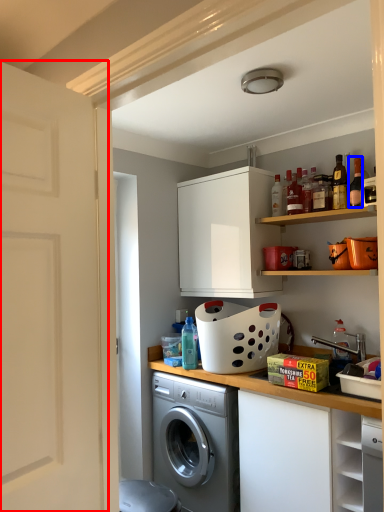
Question: Which object is closer to the camera taking this photo, door (highlighted by a red box) or bottle (highlighted by a blue box)?

Choices:
 (A) door
 (B) bottle

Answer: (A)